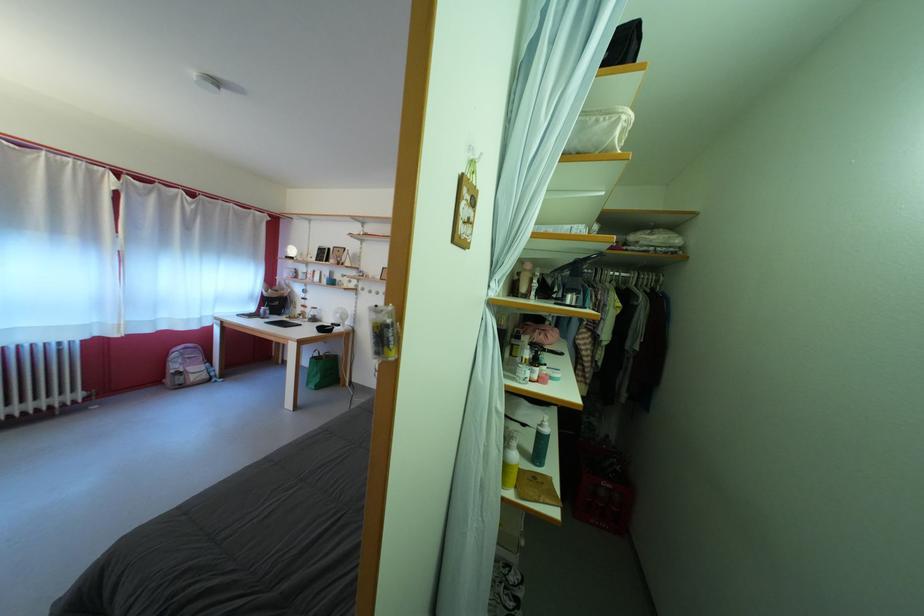
The height and width of the screenshot is (616, 924). Find the location of `black computer mouse`. black computer mouse is located at coordinates (324, 328).